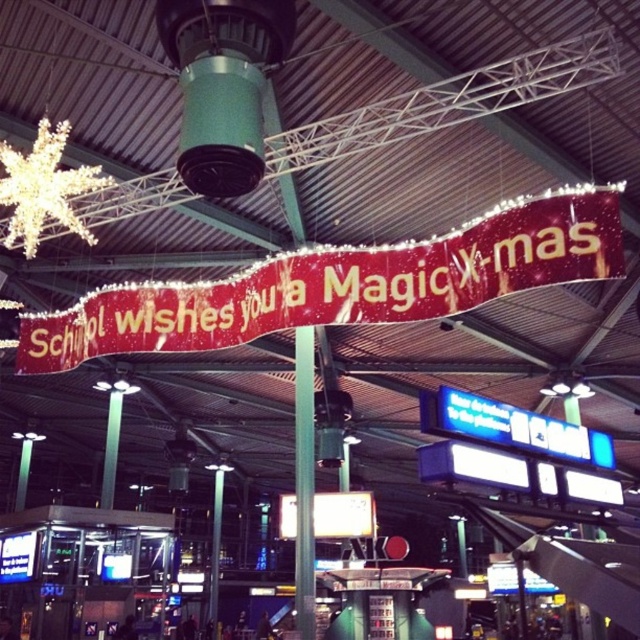
Is shiny red banner at center below green metallic pole at center?

Incorrect, shiny red banner at center is not positioned below green metallic pole at center.

Find the location of a particular element. Image resolution: width=640 pixels, height=640 pixels. shiny red banner at center is located at coordinates (342, 284).

You are a GUI agent. You are given a task and a screenshot of the screen. Output one action in this format:
    pyautogui.click(x=<x>, y=<y>)
    Task: Click on the shiny red banner at center
    The width and height of the screenshot is (640, 640).
    Given the screenshot: What is the action you would take?
    pyautogui.click(x=342, y=284)